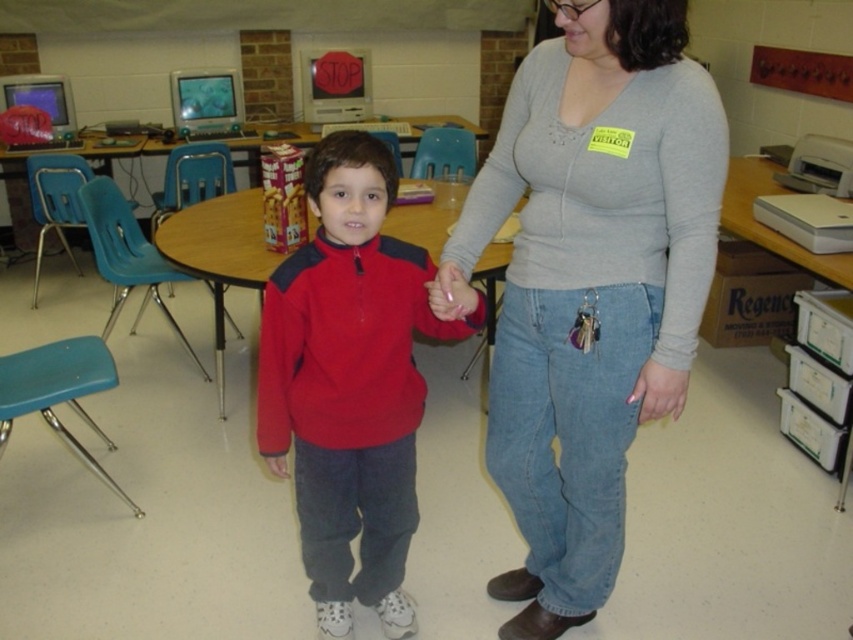
Question: Is gray sweater at center to the left of matte red sweater at center from the viewer's perspective?

Choices:
 (A) no
 (B) yes

Answer: (A)

Question: Which object is closer to the camera taking this photo?

Choices:
 (A) matte red sweater at center
 (B) gray sweater at center

Answer: (B)

Question: Is gray sweater at center to the right of matte red sweater at center from the viewer's perspective?

Choices:
 (A) yes
 (B) no

Answer: (A)

Question: Can you confirm if gray sweater at center is positioned to the left of matte red sweater at center?

Choices:
 (A) yes
 (B) no

Answer: (B)

Question: Which of the following is the closest to the observer?

Choices:
 (A) matte red sweater at center
 (B) gray sweater at center

Answer: (B)

Question: Which of the following is the closest to the observer?

Choices:
 (A) (345, 392)
 (B) (578, 595)

Answer: (A)